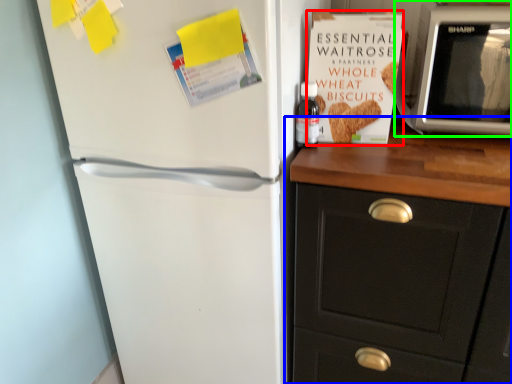
Question: Which is nearer to the paperback book (highlighted by a red box)? cabinetry (highlighted by a blue box) or microwave oven (highlighted by a green box).

Choices:
 (A) cabinetry
 (B) microwave oven

Answer: (B)